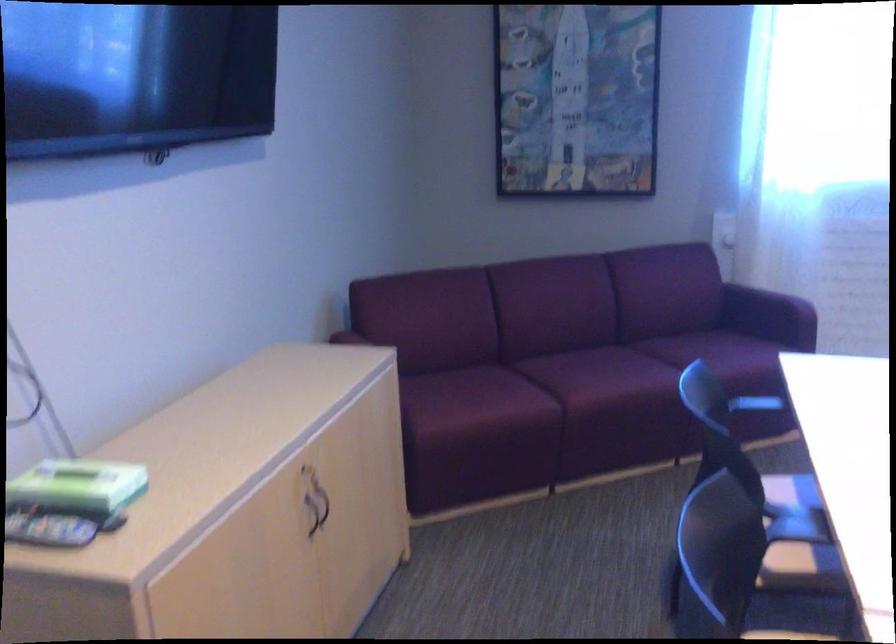
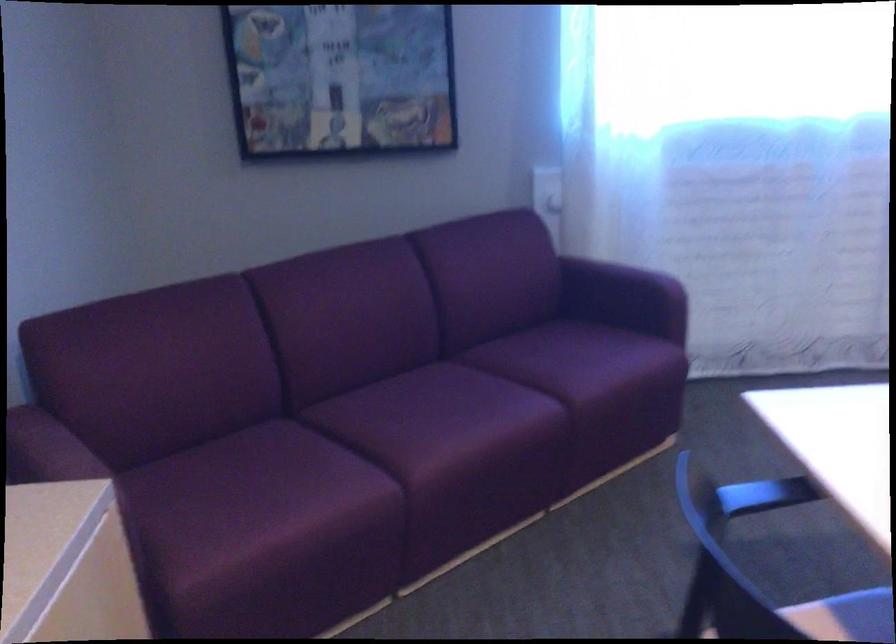
Find the pixel in the second image that matches point (765, 312) in the first image.

(617, 289)